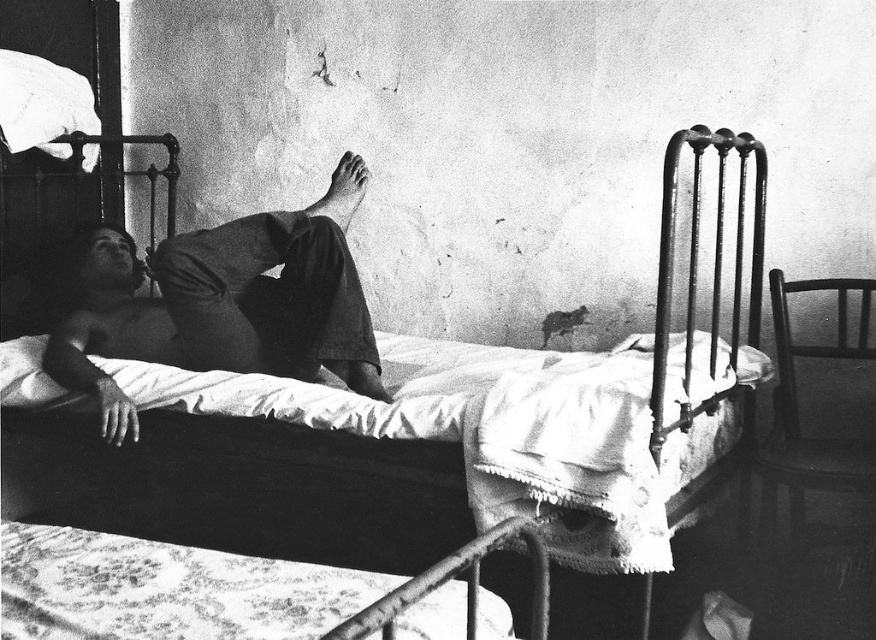
Between dark gray fabric shirt at center and metallic iron bed at center, which one has more height?

metallic iron bed at center is taller.

Does dark gray fabric shirt at center have a greater height compared to metallic iron bed at center?

Incorrect, dark gray fabric shirt at center's height is not larger of metallic iron bed at center's.

Locate an element on the screen. The height and width of the screenshot is (640, 876). dark gray fabric shirt at center is located at coordinates (223, 304).